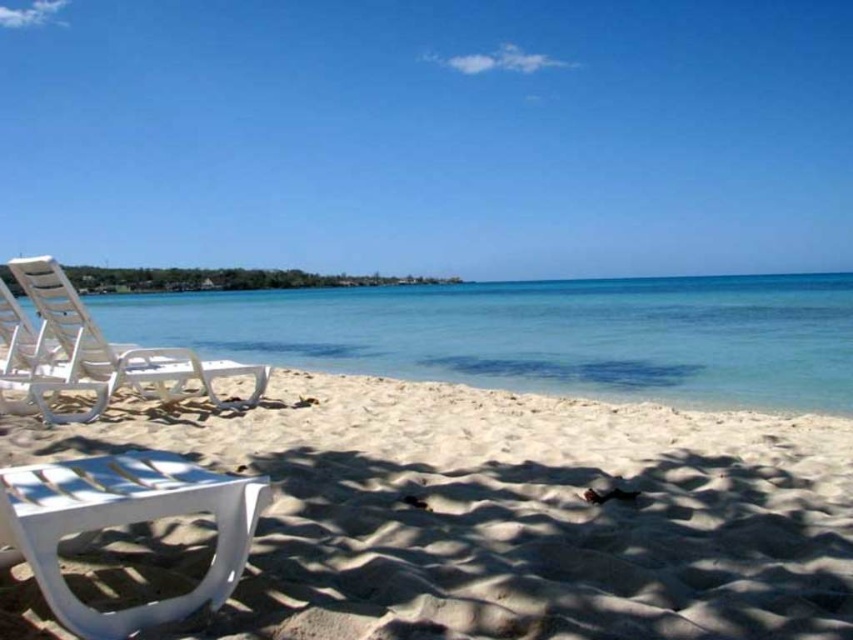
Based on the photo, you are standing at the center of the beach. You want to find the white sand at lower left. Which direction should you look to see it?

You should look towards the lower left direction to see the white sand at lower left, as it is located at point (509, 513).

You are standing on the beach and want to place a small bag between the white sand at lower left and the white plastic chair at lower left. Can you fit the bag there without moving the chair?

The white sand at lower left is wider than the white plastic chair at lower left, so there is enough space to place the bag between them without moving the chair.

You are standing on the beach and want to walk towards the clear blue water at center. There is a white plastic beach chair at left in your path. Which object will you encounter first?

You will encounter the white plastic beach chair at left first because it is closer to you than the clear blue water at center, which is further away.